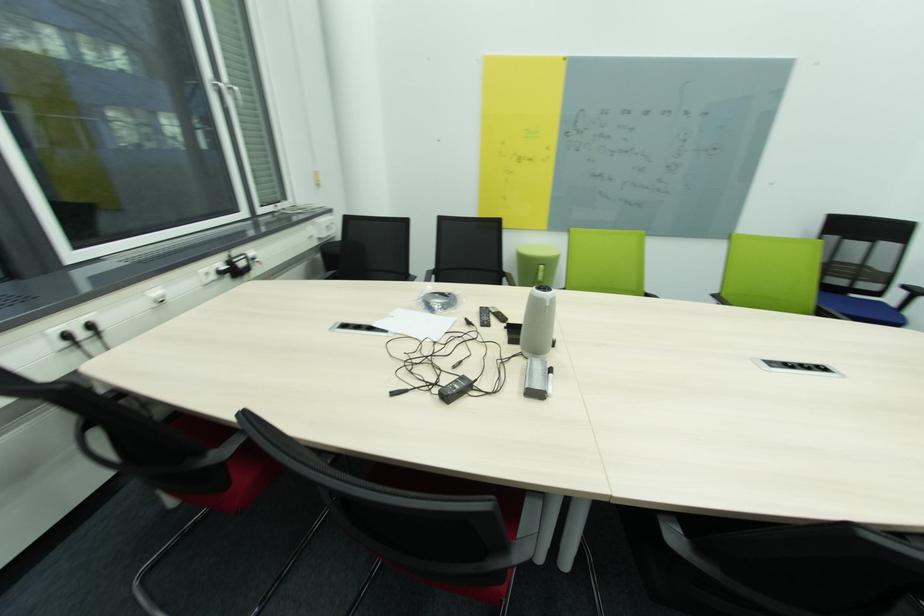
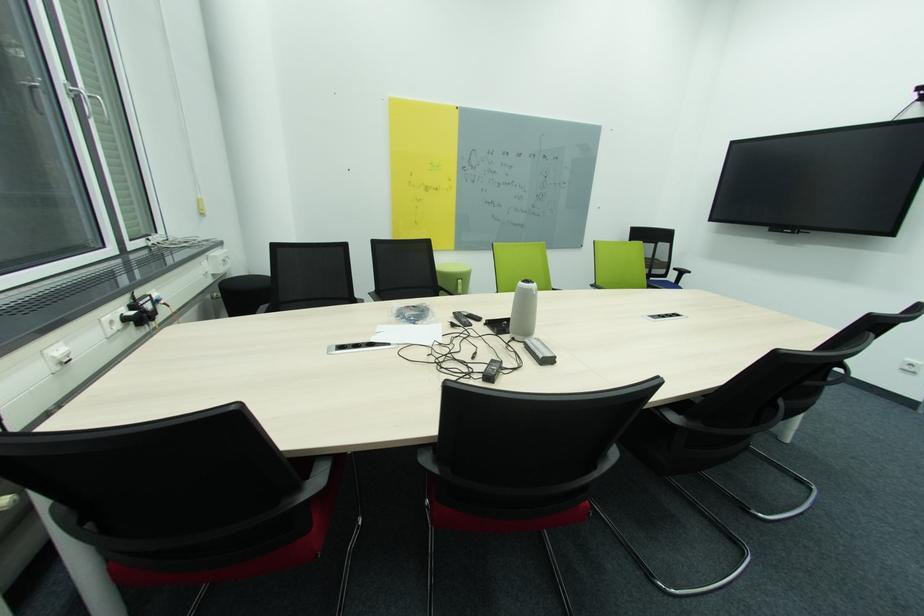
In the second image, find the point that corresponds to pixel 468 379 in the first image.

(497, 362)